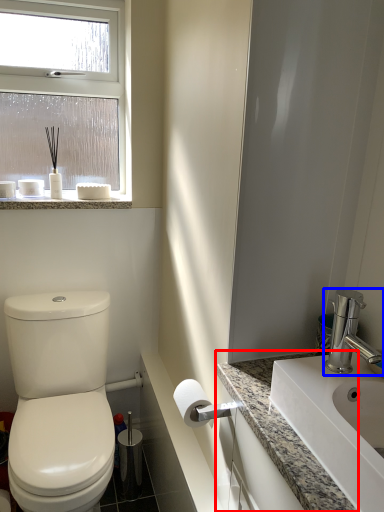
Question: Which object appears closest to the camera in this image, counter top (highlighted by a red box) or tap (highlighted by a blue box)?

Choices:
 (A) counter top
 (B) tap

Answer: (A)